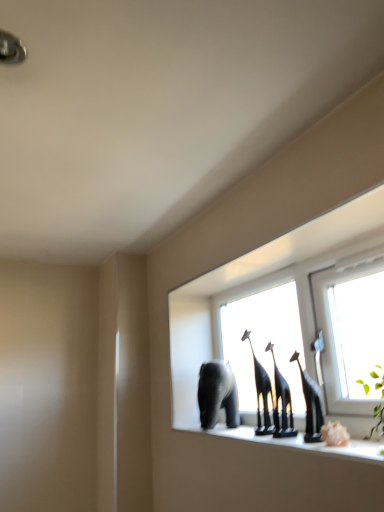
The width and height of the screenshot is (384, 512). What are the coordinates of `free space above transparent glass window at center (from a real-world perspective)` in the screenshot? It's located at click(274, 274).